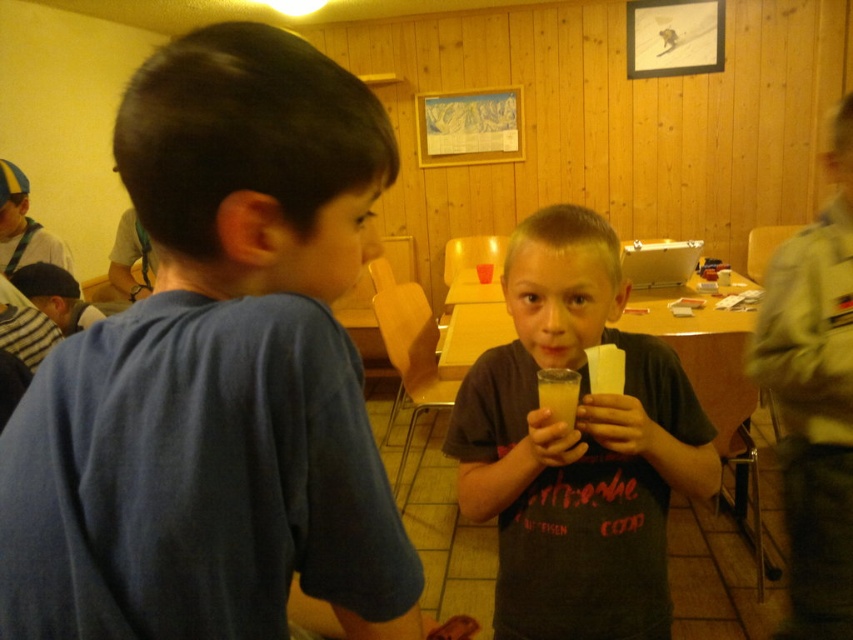
Question: Which of the following is the farthest from the observer?

Choices:
 (A) (351, 156)
 (B) (646, 413)

Answer: (B)

Question: Is blue cotton shirt at upper left positioned behind matte gray shirt at center?

Choices:
 (A) yes
 (B) no

Answer: (B)

Question: Can you confirm if blue cotton shirt at upper left is thinner than matte gray shirt at center?

Choices:
 (A) no
 (B) yes

Answer: (B)

Question: Can you confirm if blue cotton shirt at upper left is bigger than matte gray shirt at center?

Choices:
 (A) yes
 (B) no

Answer: (B)

Question: Which object is closer to the camera taking this photo?

Choices:
 (A) blue cotton shirt at upper left
 (B) matte gray shirt at center

Answer: (A)

Question: Which point is closer to the camera?

Choices:
 (A) matte gray shirt at center
 (B) blue cotton shirt at upper left

Answer: (B)